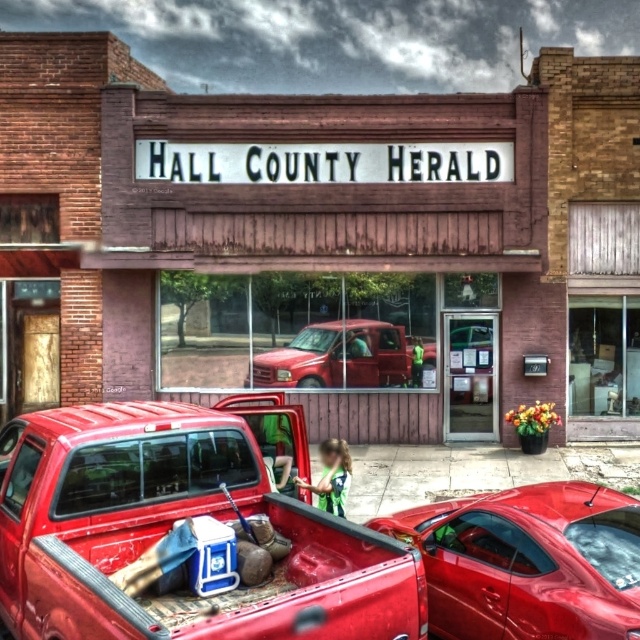
Is metallic red pickup truck at center positioned behind glossy red car at center?

No, metallic red pickup truck at center is in front of glossy red car at center.

Is metallic red pickup truck at center in front of glossy red car at center?

Yes.

Locate an element on the screen. This screenshot has height=640, width=640. metallic red pickup truck at center is located at coordinates (182, 532).

The width and height of the screenshot is (640, 640). Identify the location of metallic red pickup truck at center. (182, 532).

Which is behind, point (576, 636) or point (388, 323)?

The point (388, 323) is behind.

Between point (452, 566) and point (388, 355), which one is positioned behind?

The point (388, 355) is behind.

At what (x,y) coordinates should I click in order to perform the action: click on glossy red car at center. Please return your answer as a coordinate pair (x, y). Image resolution: width=640 pixels, height=640 pixels. Looking at the image, I should click on (528, 561).

Who is taller, metallic red pickup truck at center or matte red truck at center?

With more height is metallic red pickup truck at center.

Which is behind, point (28, 518) or point (314, 380)?

Point (314, 380)

Image resolution: width=640 pixels, height=640 pixels. In order to click on metallic red pickup truck at center in this screenshot , I will do `click(182, 532)`.